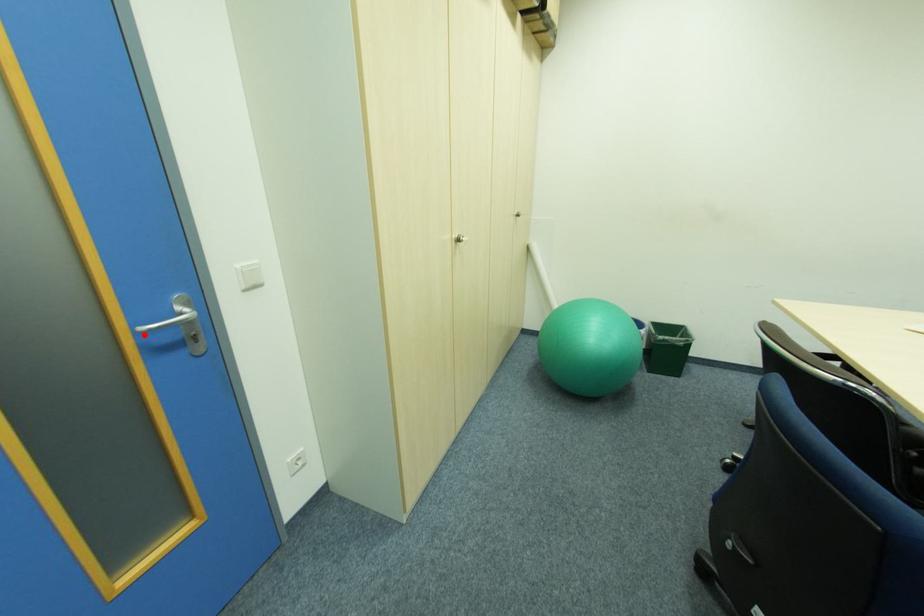
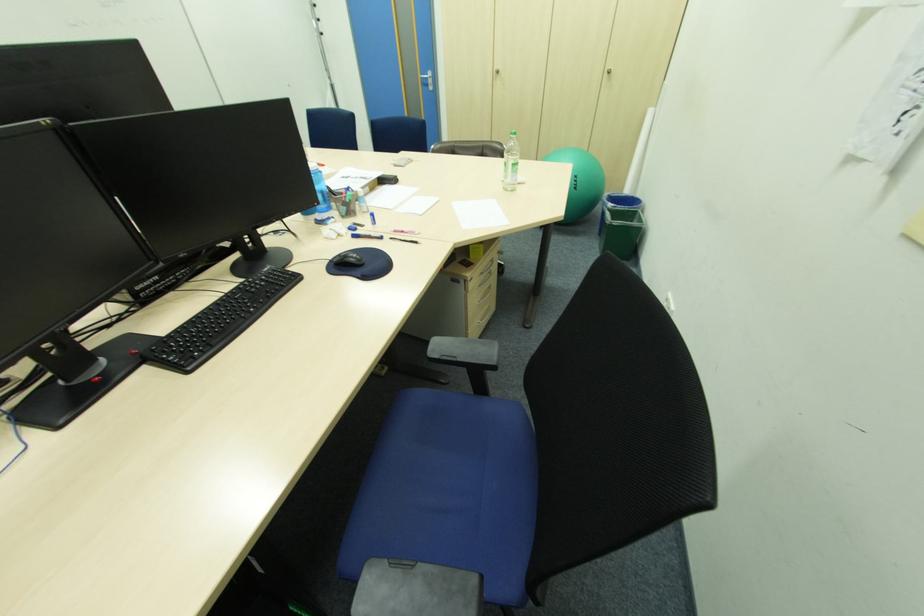
Question: I am providing you with two images of the same scene from different viewpoints. Image1 has a red point marked. In image2, the corresponding 3D location appears at what relative position? Reply with the corresponding letter.

Choices:
 (A) Closer
 (B) Farther

Answer: (A)